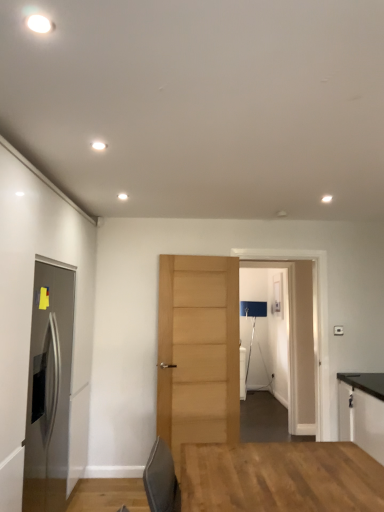
Question: Which direction should I rotate to face light brown wood door at center, which is counted as the 2th door, starting from the left, — up or down?

Choices:
 (A) down
 (B) up

Answer: (A)

Question: Considering the relative sizes of transparent glass door at center and satin stainless steel refrigerator at left, acting as the second door starting from the back, in the image provided, is transparent glass door at center thinner than satin stainless steel refrigerator at left, acting as the second door starting from the back,?

Choices:
 (A) yes
 (B) no

Answer: (A)

Question: From a real-world perspective, is transparent glass door at center on top of satin stainless steel refrigerator at left, the second door when ordered from right to left?

Choices:
 (A) yes
 (B) no

Answer: (A)

Question: Is transparent glass door at center to the right of satin stainless steel refrigerator at left, the second door when ordered from right to left, from the viewer's perspective?

Choices:
 (A) no
 (B) yes

Answer: (B)

Question: Is transparent glass door at center oriented away from satin stainless steel refrigerator at left, acting as the second door starting from the back?

Choices:
 (A) yes
 (B) no

Answer: (B)

Question: Can you confirm if transparent glass door at center is smaller than satin stainless steel refrigerator at left, which ranks as the first door in left-to-right order?

Choices:
 (A) yes
 (B) no

Answer: (A)

Question: From the image's perspective, is transparent glass door at center on top of satin stainless steel refrigerator at left, the second door when ordered from right to left?

Choices:
 (A) no
 (B) yes

Answer: (B)

Question: Can you confirm if light brown wood door at center, which is the 1th door from right to left, is bigger than black laminate cabinet at right?

Choices:
 (A) yes
 (B) no

Answer: (B)

Question: From a real-world perspective, is light brown wood door at center, which is the 1th door from right to left, beneath black laminate cabinet at right?

Choices:
 (A) no
 (B) yes

Answer: (A)

Question: Considering the relative sizes of light brown wood door at center, marked as the second door in a front-to-back arrangement, and black laminate cabinet at right in the image provided, is light brown wood door at center, marked as the second door in a front-to-back arrangement, smaller than black laminate cabinet at right?

Choices:
 (A) yes
 (B) no

Answer: (A)

Question: From the image's perspective, is light brown wood door at center, the first door in the back-to-front sequence, beneath black laminate cabinet at right?

Choices:
 (A) yes
 (B) no

Answer: (B)

Question: Is light brown wood door at center, the first door in the back-to-front sequence, taller than black laminate cabinet at right?

Choices:
 (A) no
 (B) yes

Answer: (B)

Question: Is light brown wood door at center, which is counted as the 2th door, starting from the left, facing towards black laminate cabinet at right?

Choices:
 (A) no
 (B) yes

Answer: (A)

Question: Considering the relative sizes of satin stainless steel refrigerator at left, the second door when ordered from right to left, and black laminate cabinet at right in the image provided, is satin stainless steel refrigerator at left, the second door when ordered from right to left, taller than black laminate cabinet at right?

Choices:
 (A) yes
 (B) no

Answer: (A)